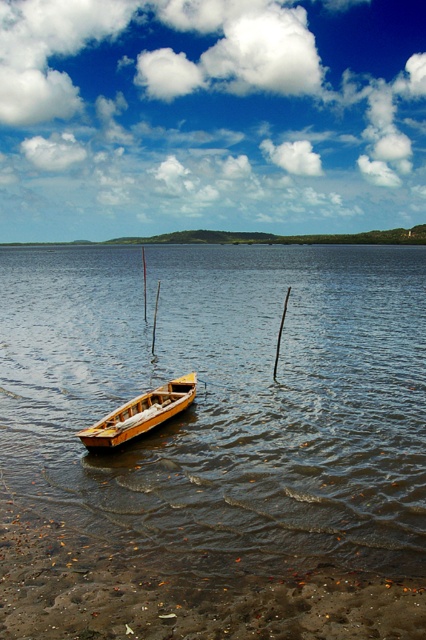
Who is shorter, brown wooden water at center or wooden boat at center?

wooden boat at center is shorter.

Looking at this image, who is lower down, brown wooden water at center or wooden boat at center?

Positioned lower is wooden boat at center.

Which is behind, point (241, 518) or point (184, 404)?

Positioned behind is point (184, 404).

Locate an element on the screen. Image resolution: width=426 pixels, height=640 pixels. brown wooden water at center is located at coordinates coord(224,400).